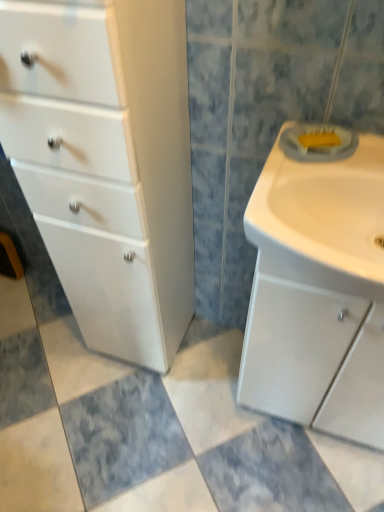
Question: Relative to white glossy sink at right, is white glossy cabinet at left in front or behind?

Choices:
 (A) front
 (B) behind

Answer: (A)

Question: Would you say white glossy cabinet at left is inside or outside white glossy sink at right?

Choices:
 (A) outside
 (B) inside

Answer: (A)

Question: Which object is the farthest from the white glossy sink at right?

Choices:
 (A) white matte sink cabinet at right
 (B) white glossy cabinet at left

Answer: (B)

Question: Which of these objects is positioned farthest from the white glossy sink at right?

Choices:
 (A) white glossy cabinet at left
 (B) white matte sink cabinet at right

Answer: (A)